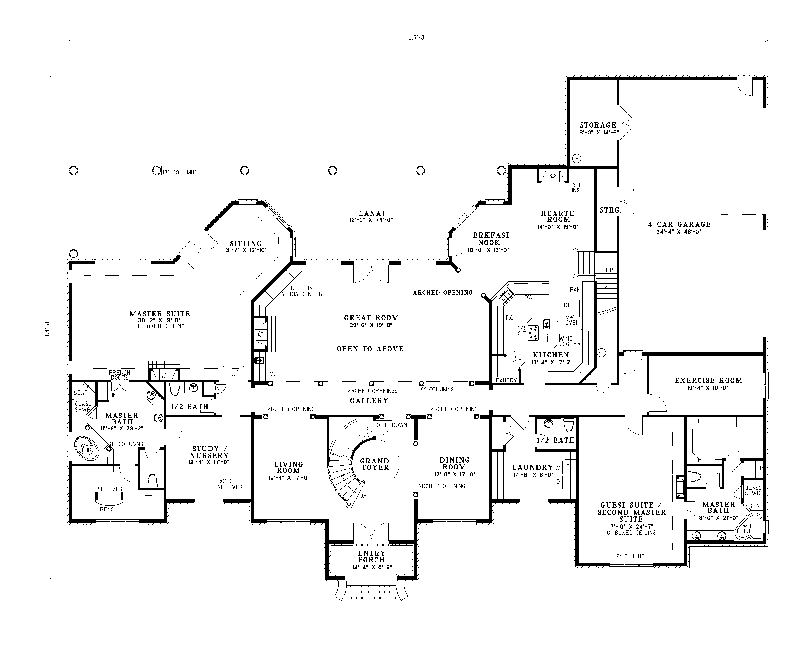
In order to click on breakfast nook in this screenshot , I will do `click(484, 204)`, `click(509, 203)`, `click(514, 274)`, `click(486, 300)`, `click(450, 256)`.